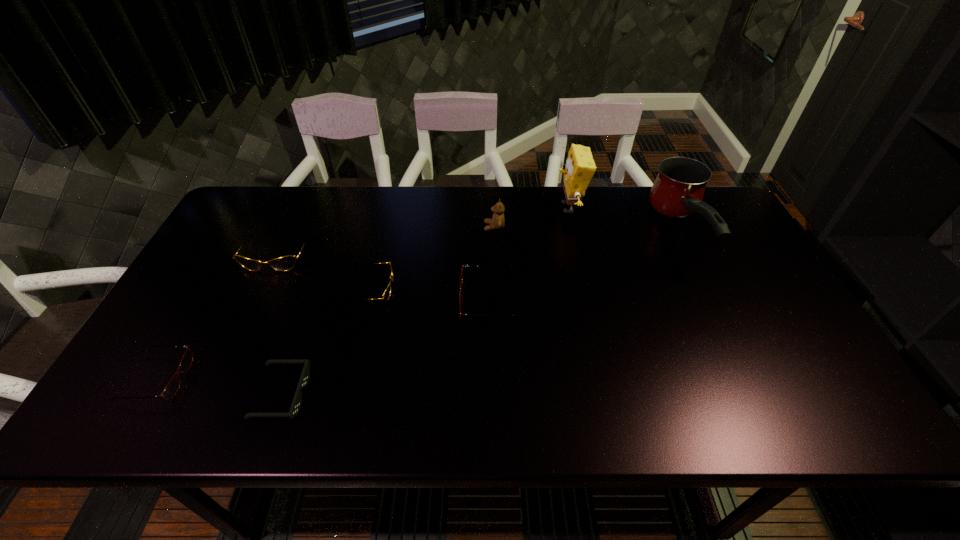
This screenshot has height=540, width=960. I want to click on the nearer red spectacles, so click(171, 389).

Identify the location of the left red spectacles. (171, 389).

The width and height of the screenshot is (960, 540). What are the coordinates of `the shortest object` in the screenshot? It's located at (305, 375).

Where is `black sunglasses`? black sunglasses is located at coordinates (305, 375).

Where is `vacant space located 0.200m on the face of the sponge`? The width and height of the screenshot is (960, 540). vacant space located 0.200m on the face of the sponge is located at coordinates (492, 208).

Locate an element on the screen. The image size is (960, 540). vacant point located on the face of the sponge is located at coordinates (452, 208).

You are a GUI agent. You are given a task and a screenshot of the screen. Output one action in this format:
    pyautogui.click(x=<x>, y=<y>)
    Task: Click on the free space located 0.220m on the face of the sponge
    The image size is (960, 540).
    Given the screenshot: What is the action you would take?
    pyautogui.click(x=486, y=208)

Identify the location of free space located 0.310m on the handle side of the saucepan. (751, 374).

Locate an element on the screen. This screenshot has width=960, height=540. vacant space situated on the front-facing side of the teddy bear is located at coordinates (407, 227).

Find the location of a particular element. This screenshot has width=960, height=540. vacant region located on the front-facing side of the teddy bear is located at coordinates coord(397,227).